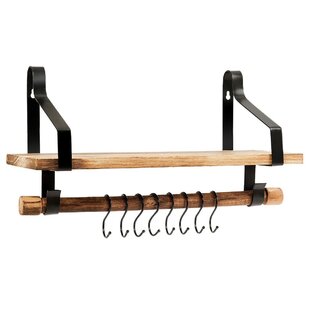
This screenshot has height=310, width=310. Identify the location of the 1st black hook. (107, 235).